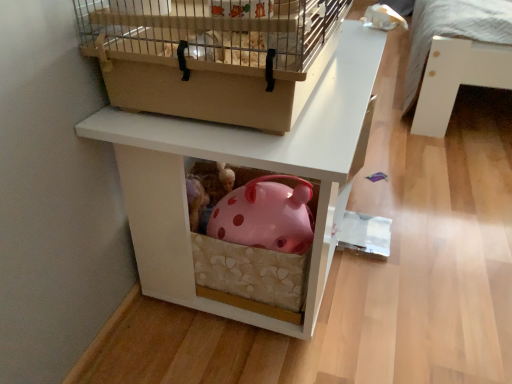
Question: From a real-world perspective, is wooden birdcage at upper center on pink polka dot piggy bank at center?

Choices:
 (A) yes
 (B) no

Answer: (A)

Question: Can you confirm if wooden birdcage at upper center is positioned to the left of pink polka dot piggy bank at center?

Choices:
 (A) no
 (B) yes

Answer: (B)

Question: Could you tell me if wooden birdcage at upper center is facing pink polka dot piggy bank at center?

Choices:
 (A) no
 (B) yes

Answer: (A)

Question: Is wooden birdcage at upper center outside pink polka dot piggy bank at center?

Choices:
 (A) no
 (B) yes

Answer: (B)

Question: Is pink polka dot piggy bank at center located within wooden birdcage at upper center?

Choices:
 (A) no
 (B) yes

Answer: (A)

Question: Is wooden birdcage at upper center positioned far away from pink polka dot piggy bank at center?

Choices:
 (A) yes
 (B) no

Answer: (B)

Question: Is pink polka dot piggy bank at center facing towards wooden birdcage at upper center?

Choices:
 (A) no
 (B) yes

Answer: (A)

Question: Is pink polka dot piggy bank at center positioned behind wooden birdcage at upper center?

Choices:
 (A) no
 (B) yes

Answer: (B)

Question: Considering the relative sizes of pink polka dot piggy bank at center and wooden birdcage at upper center in the image provided, is pink polka dot piggy bank at center thinner than wooden birdcage at upper center?

Choices:
 (A) no
 (B) yes

Answer: (A)

Question: From the image's perspective, is pink polka dot piggy bank at center located beneath wooden birdcage at upper center?

Choices:
 (A) no
 (B) yes

Answer: (B)

Question: Is pink polka dot piggy bank at center not inside wooden birdcage at upper center?

Choices:
 (A) no
 (B) yes

Answer: (B)

Question: From a real-world perspective, is pink polka dot piggy bank at center below wooden birdcage at upper center?

Choices:
 (A) yes
 (B) no

Answer: (A)

Question: Is pink polka dot piggy bank at center taller or shorter than wooden birdcage at upper center?

Choices:
 (A) short
 (B) tall

Answer: (B)